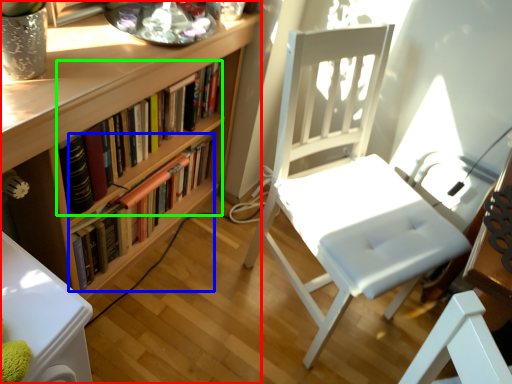
Question: Estimate the real-world distances between objects in this image. Which object is farther from bookcase (highlighted by a red box), book (highlighted by a blue box) or book (highlighted by a green box)?

Choices:
 (A) book
 (B) book

Answer: (A)